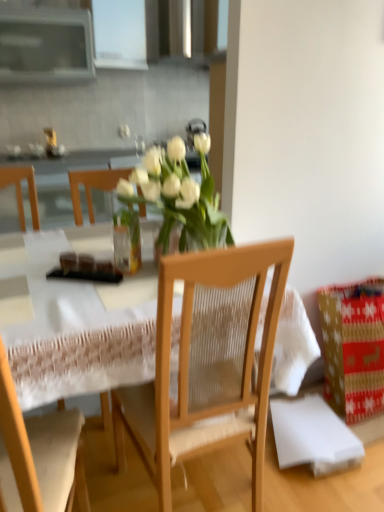
At what (x,y) coordinates should I click in order to perform the action: click on vacant space behind transparent glass vase at center. Please return your answer as a coordinate pair (x, y). The width and height of the screenshot is (384, 512). Looking at the image, I should click on (114, 252).